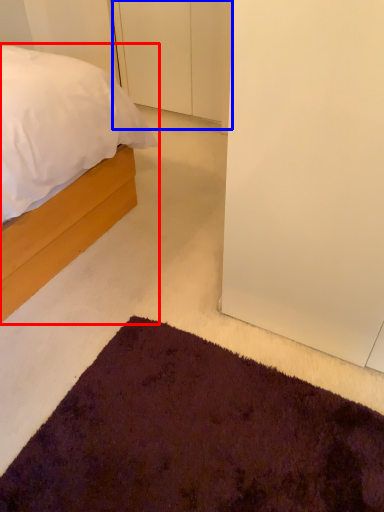
Question: Which object is closer to the camera taking this photo, bed (highlighted by a red box) or door (highlighted by a blue box)?

Choices:
 (A) bed
 (B) door

Answer: (A)